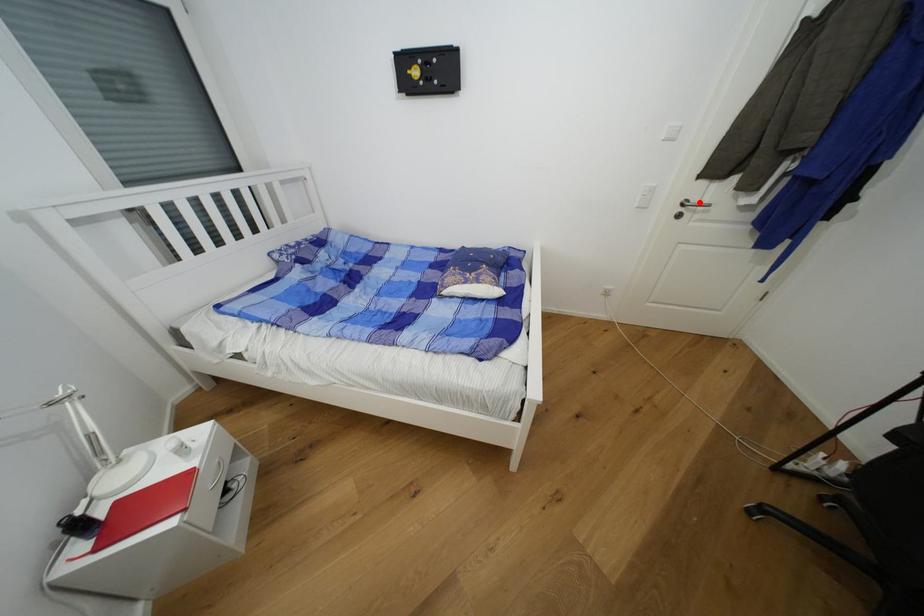
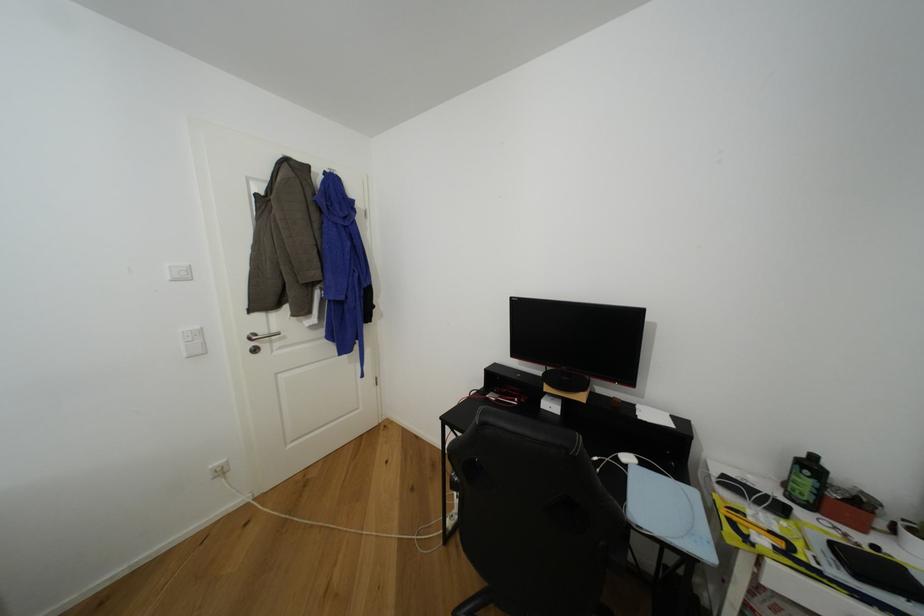
In the second image, find the point that corresponds to the highlighted location in the first image.

(268, 334)